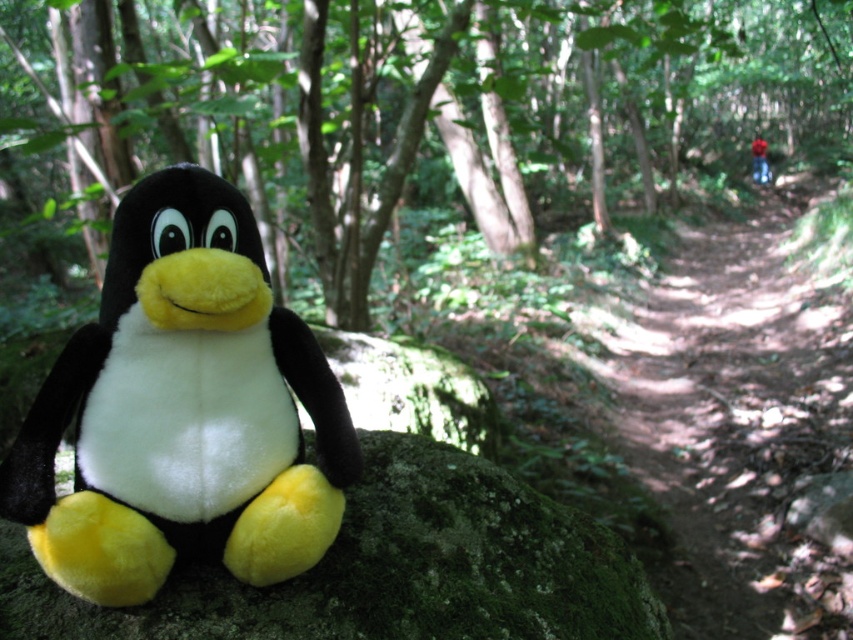
Question: Can you confirm if soft plush penguin at left is wider than dirt path at center?

Choices:
 (A) yes
 (B) no

Answer: (B)

Question: Is soft plush penguin at left smaller than green mossy rock at lower left?

Choices:
 (A) no
 (B) yes

Answer: (B)

Question: Is soft plush penguin at left bigger than dirt path at center?

Choices:
 (A) no
 (B) yes

Answer: (A)

Question: Which object is positioned farthest from the green mossy rock at lower left?

Choices:
 (A) soft plush penguin at left
 (B) dirt path at center

Answer: (B)

Question: Which of the following is the closest to the observer?

Choices:
 (A) (578, 600)
 (B) (161, 198)
 (C) (802, 392)

Answer: (B)

Question: Among these objects, which one is nearest to the camera?

Choices:
 (A) dirt path at center
 (B) green mossy rock at lower left

Answer: (B)